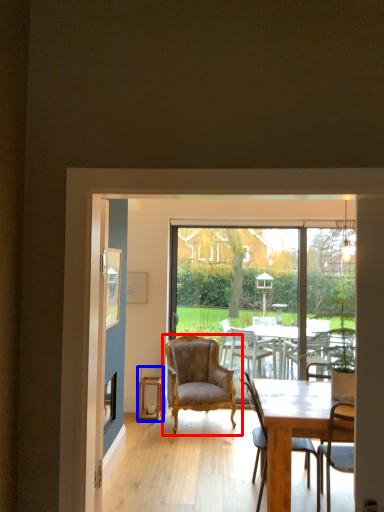
Question: Which point is further to the camera, chair (highlighted by a red box) or stool (highlighted by a blue box)?

Choices:
 (A) chair
 (B) stool

Answer: (B)